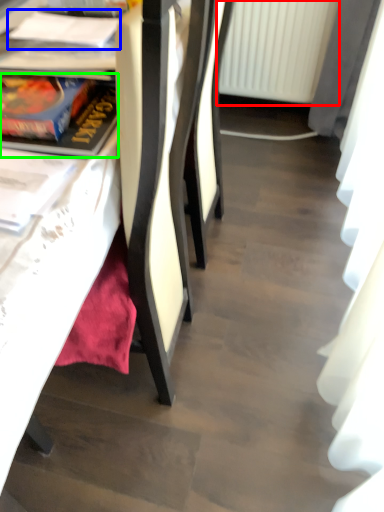
Question: Based on their relative distances, which object is nearer to radiator (highlighted by a red box)? Choose from book (highlighted by a blue box) and book (highlighted by a green box).

Choices:
 (A) book
 (B) book

Answer: (A)